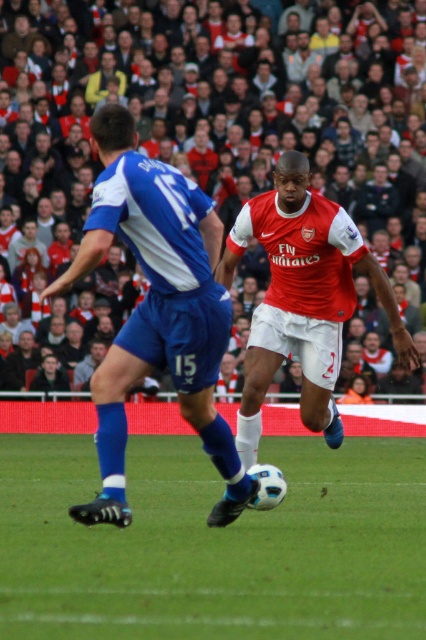
You are a soccer player trying to pass the ball to your teammate. You notice the red fabric crowd at upper center and the blue fabric shorts at left. Which of these two objects is larger in size?

The red fabric crowd at upper center is bigger than the blue fabric shorts at left.

You are a soccer player wearing blue fabric shorts at left and you need to pass the ball to your teammate. Looking at the image, which direction should you pass the ball to avoid the red fabric crowd at upper center?

You should pass the ball below the red fabric crowd at upper center since the red fabric crowd at upper center is above the blue fabric shorts at left.